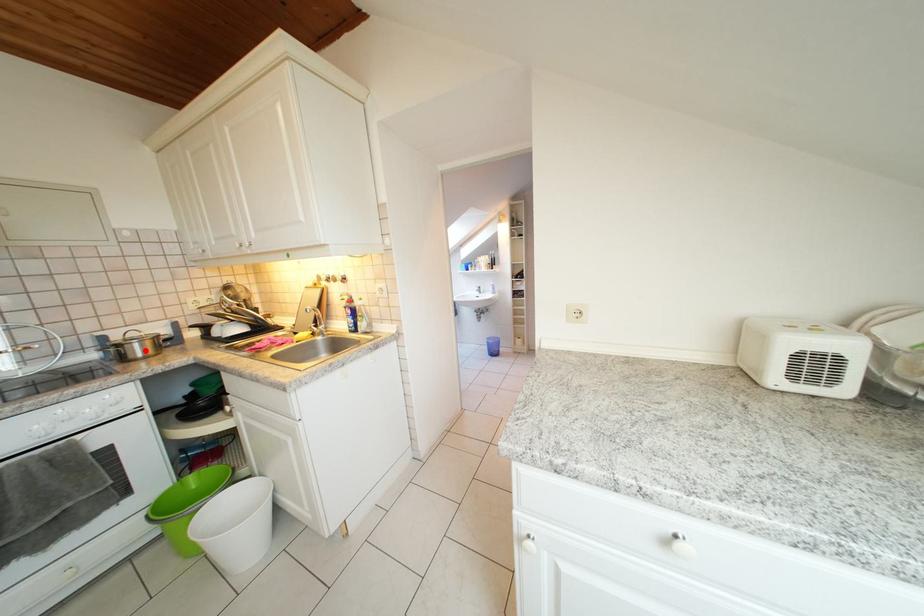
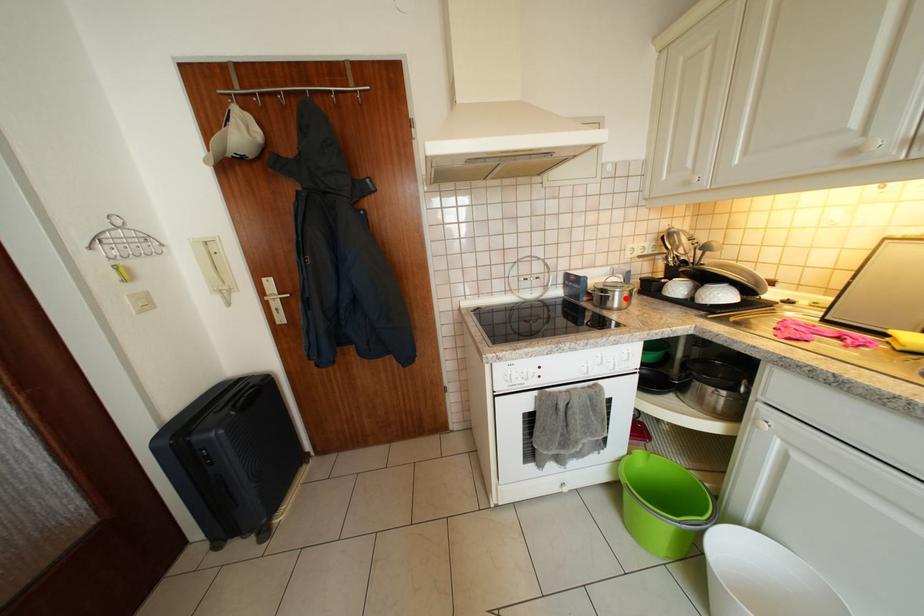
Consider the image. I am providing you with two images of the same scene from different viewpoints. A red point is marked on the first image and another point is marked on the second image. Is the red point in image1 aligned with the point shown in image2?

Yes